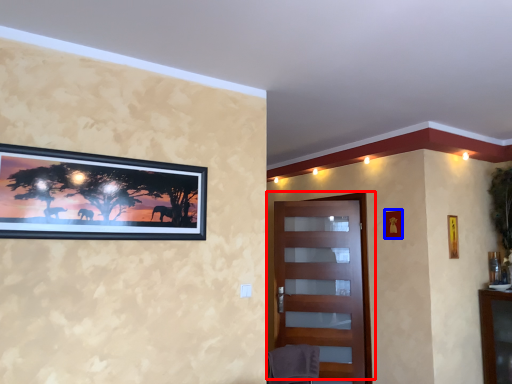
Question: Which point is closer to the camera, door (highlighted by a red box) or picture frame (highlighted by a blue box)?

Choices:
 (A) door
 (B) picture frame

Answer: (B)